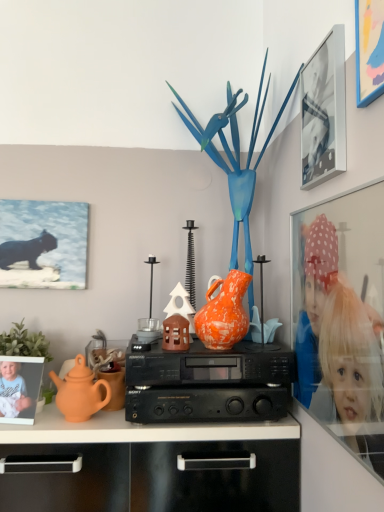
Question: Can you confirm if orange speckled vase at center is shorter than blue glossy bird at center?

Choices:
 (A) no
 (B) yes

Answer: (B)

Question: From the image's perspective, is orange speckled vase at center above blue glossy bird at center?

Choices:
 (A) yes
 (B) no

Answer: (B)

Question: Is orange speckled vase at center oriented towards blue glossy bird at center?

Choices:
 (A) yes
 (B) no

Answer: (A)

Question: Does orange speckled vase at center have a greater height compared to blue glossy bird at center?

Choices:
 (A) no
 (B) yes

Answer: (A)

Question: Is orange speckled vase at center to the left of blue glossy bird at center from the viewer's perspective?

Choices:
 (A) yes
 (B) no

Answer: (A)

Question: Can you confirm if orange speckled vase at center is smaller than blue glossy bird at center?

Choices:
 (A) yes
 (B) no

Answer: (A)

Question: Is the position of blue matte picture frame at upper right, the 1th picture frame positioned from the right, more distant than that of orange speckled vase at center?

Choices:
 (A) yes
 (B) no

Answer: (B)

Question: Does blue matte picture frame at upper right, the 4th picture frame in the left-to-right sequence, have a smaller size compared to orange speckled vase at center?

Choices:
 (A) yes
 (B) no

Answer: (A)

Question: Is blue matte picture frame at upper right, the 4th picture frame from the back, directly adjacent to orange speckled vase at center?

Choices:
 (A) yes
 (B) no

Answer: (B)

Question: Considering the relative positions of blue matte picture frame at upper right, the 4th picture frame in the left-to-right sequence, and orange speckled vase at center in the image provided, is blue matte picture frame at upper right, the 4th picture frame in the left-to-right sequence, to the right of orange speckled vase at center from the viewer's perspective?

Choices:
 (A) no
 (B) yes

Answer: (B)

Question: Does blue matte picture frame at upper right, which is the 1th picture frame in front-to-back order, have a greater height compared to orange speckled vase at center?

Choices:
 (A) no
 (B) yes

Answer: (B)

Question: Would you say orange speckled vase at center is part of blue matte picture frame at upper right, the 4th picture frame from the back,'s contents?

Choices:
 (A) no
 (B) yes

Answer: (A)

Question: From a real-world perspective, is orange speckled vase at center physically above metallic silver picture frame at upper right, marked as the second picture frame in a left-to-right arrangement?

Choices:
 (A) yes
 (B) no

Answer: (B)